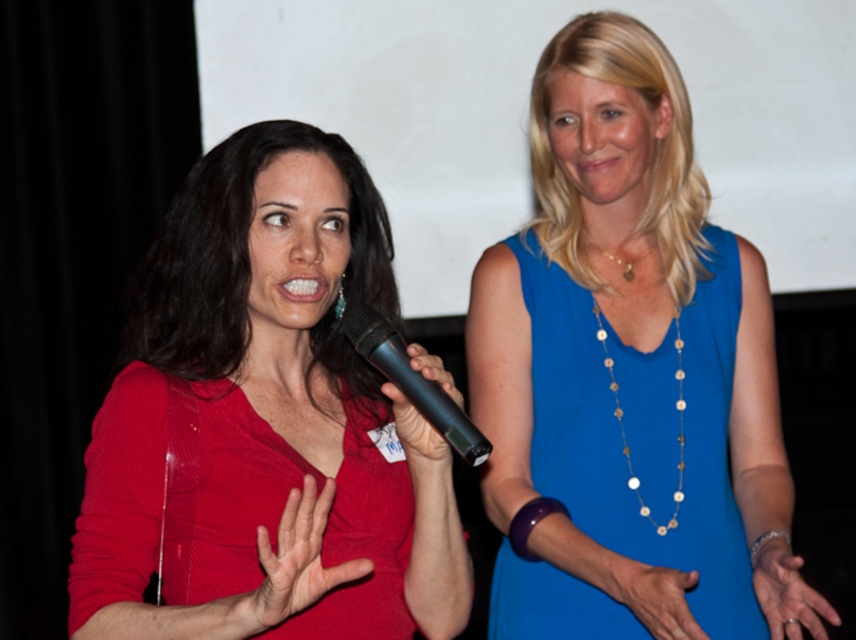
Find the location of a particular element. matte red sweater at center is located at coordinates click(x=266, y=420).

Who is higher up, matte red sweater at center or matte red hand at center?

Positioned higher is matte red sweater at center.

This screenshot has width=856, height=640. What do you see at coordinates (266, 420) in the screenshot?
I see `matte red sweater at center` at bounding box center [266, 420].

Identify the location of matte red sweater at center. (266, 420).

Who is more distant from viewer, (710, 310) or (468, 448)?

Point (710, 310)

Is blue silk dress at upper right below black plastic microphone at center?

Yes.

What do you see at coordinates (643, 429) in the screenshot?
I see `blue silk dress at upper right` at bounding box center [643, 429].

The height and width of the screenshot is (640, 856). I want to click on blue silk dress at upper right, so click(643, 429).

Measure the distance between point (265, 364) and camera.

The distance of point (265, 364) from camera is 4.52 feet.

Is point (201, 616) less distant than point (153, 371)?

Yes, point (201, 616) is closer to viewer.

Is point (288, 164) positioned before point (223, 529)?

No.

Locate an element on the screen. This screenshot has height=640, width=856. matte red sweater at center is located at coordinates (266, 420).